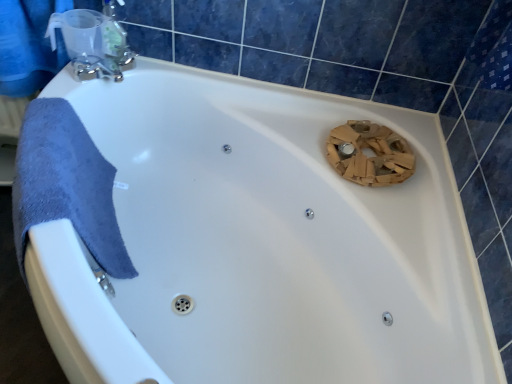
Question: Considering the positions of point (106, 36) and point (12, 74), is point (106, 36) closer or farther from the camera than point (12, 74)?

Choices:
 (A) farther
 (B) closer

Answer: (B)

Question: In terms of size, does clear plastic soap dispenser at upper left appear bigger or smaller than blue fabric towel at upper left?

Choices:
 (A) small
 (B) big

Answer: (A)

Question: Which object is positioned farthest from the blue fabric towel at upper left?

Choices:
 (A) clear plastic soap dispenser at upper left
 (B) satin nickel faucet at upper left

Answer: (A)

Question: Considering the real-world distances, which object is closest to the satin nickel faucet at upper left?

Choices:
 (A) blue fabric towel at upper left
 (B) clear plastic soap dispenser at upper left

Answer: (B)